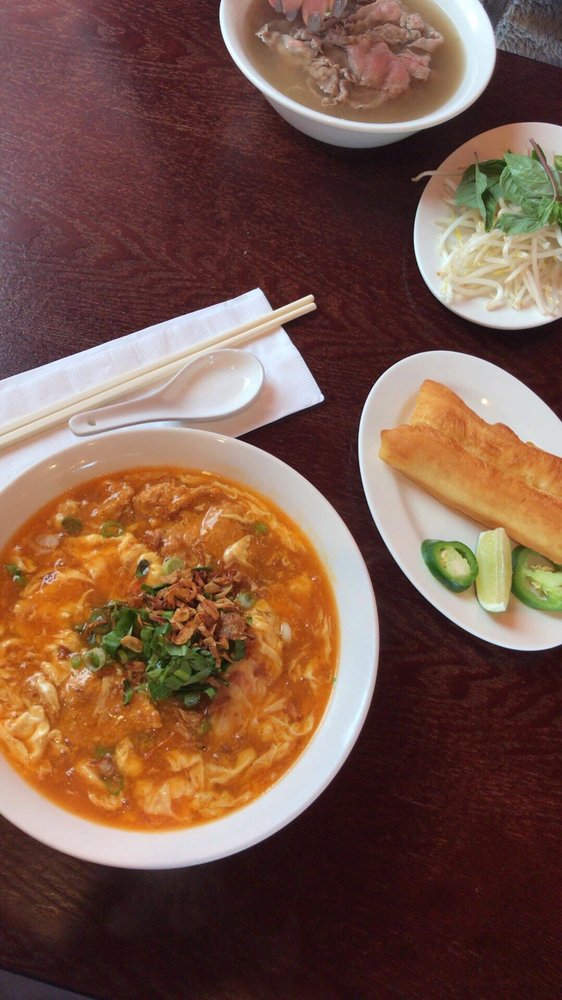
At what (x,y) coordinates should I click in order to perform the action: click on tissue. Please return your answer as a coordinate pair (x, y). This screenshot has width=562, height=1000. Looking at the image, I should click on (274, 359).